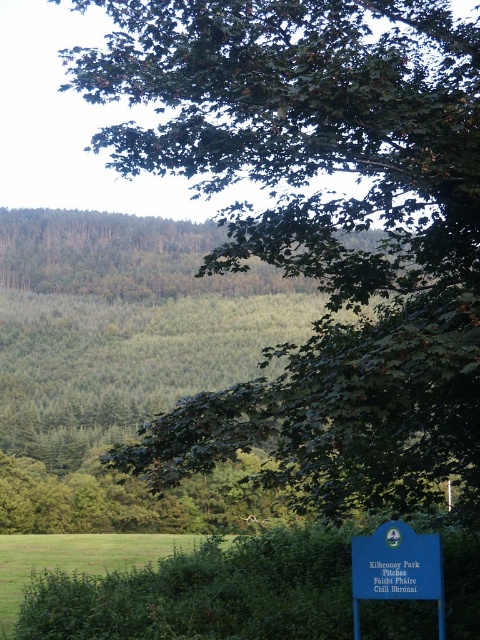
Can you confirm if green leafy hedge at lower center is bigger than blue plastic sign at lower right?

Correct, green leafy hedge at lower center is larger in size than blue plastic sign at lower right.

Between green leafy hedge at lower center and blue plastic sign at lower right, which one appears on the right side from the viewer's perspective?

blue plastic sign at lower right is more to the right.

This screenshot has width=480, height=640. What are the coordinates of `green leafy hedge at lower center` in the screenshot? It's located at (205, 593).

Where is `green leafy hedge at lower center`? green leafy hedge at lower center is located at coordinates (205, 593).

Is green grass at lower left to the right of blue plastic sign at lower right from the viewer's perspective?

Incorrect, green grass at lower left is not on the right side of blue plastic sign at lower right.

Between green grass at lower left and blue plastic sign at lower right, which one has less height?

blue plastic sign at lower right

In order to click on green grass at lower left in this screenshot , I will do `click(74, 560)`.

Who is lower down, green leafy hedge at lower center or green grass at lower left?

green grass at lower left is lower down.

Can you confirm if green leafy hedge at lower center is positioned below green grass at lower left?

Incorrect, green leafy hedge at lower center is not positioned below green grass at lower left.

Is point (94, 586) positioned behind point (45, 554)?

That is False.

Image resolution: width=480 pixels, height=640 pixels. In order to click on green leafy hedge at lower center in this screenshot , I will do `click(205, 593)`.